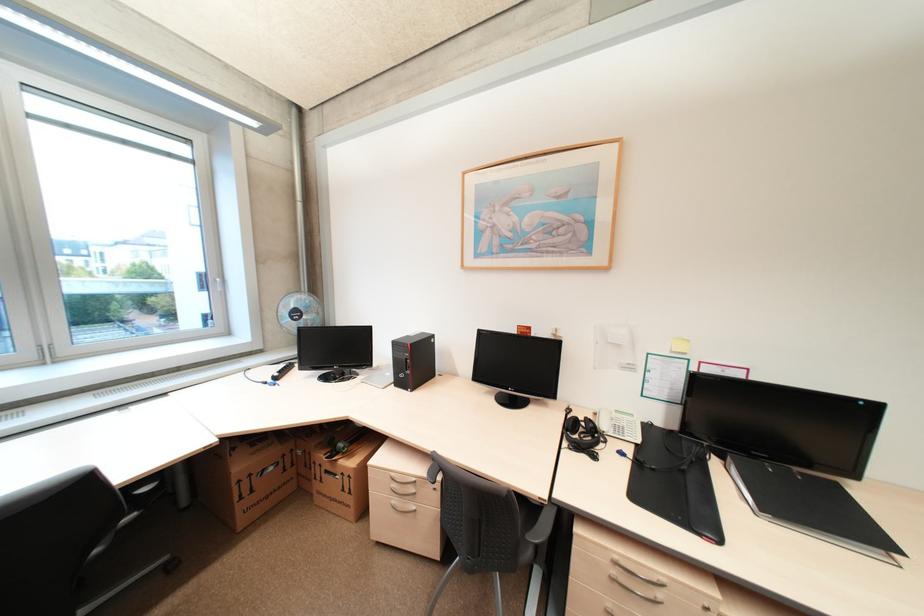
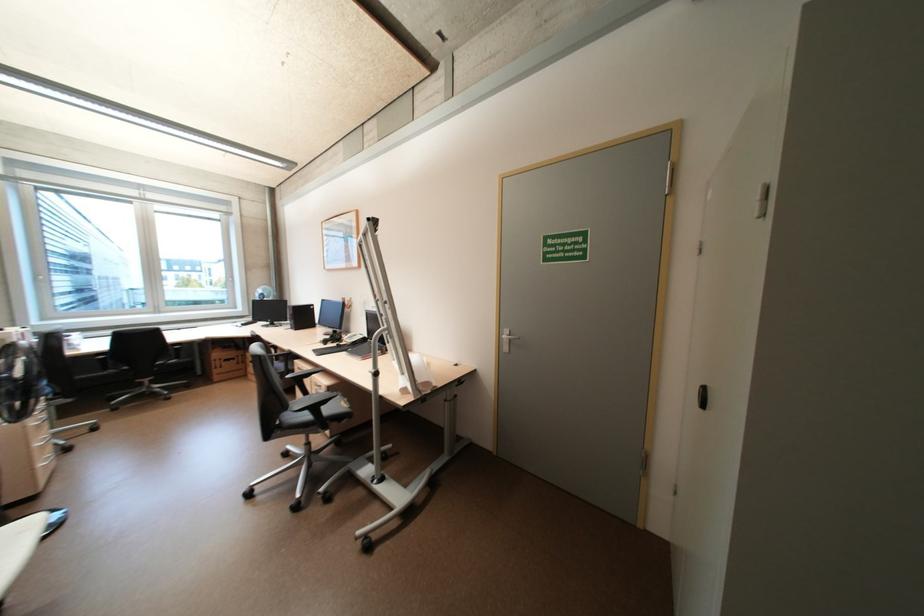
The images are taken continuously from a first-person perspective. In which direction are you moving?

The cameraman moved toward right, backward.